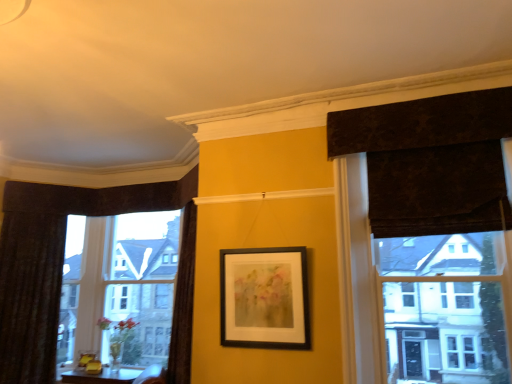
Question: Considering the relative positions of clear glass window at left and dark textured curtain at upper right, the first curtain in the front-to-back sequence, in the image provided, is clear glass window at left in front of dark textured curtain at upper right, the first curtain in the front-to-back sequence,?

Choices:
 (A) no
 (B) yes

Answer: (A)

Question: Does clear glass window at left have a smaller size compared to dark textured curtain at upper right, the second curtain in the back-to-front sequence?

Choices:
 (A) no
 (B) yes

Answer: (A)

Question: Is clear glass window at left aimed at dark textured curtain at upper right, the first curtain in the front-to-back sequence?

Choices:
 (A) yes
 (B) no

Answer: (B)

Question: From a real-world perspective, is clear glass window at left located beneath dark textured curtain at upper right, positioned as the 1th curtain in right-to-left order?

Choices:
 (A) no
 (B) yes

Answer: (B)

Question: Is dark textured curtain at upper right, the first curtain in the front-to-back sequence, completely or partially inside clear glass window at left?

Choices:
 (A) no
 (B) yes

Answer: (A)

Question: Is velvet dark brown curtain at left, which is counted as the first curtain, starting from the back, situated inside clear glass window at left or outside?

Choices:
 (A) inside
 (B) outside

Answer: (B)

Question: In the image, is velvet dark brown curtain at left, which appears as the first curtain when viewed from the left, on the left side or the right side of clear glass window at left?

Choices:
 (A) right
 (B) left

Answer: (B)

Question: From a real-world perspective, is velvet dark brown curtain at left, which is counted as the first curtain, starting from the back, physically located above or below clear glass window at left?

Choices:
 (A) below
 (B) above

Answer: (A)

Question: Considering the positions of velvet dark brown curtain at left, which is counted as the first curtain, starting from the back, and clear glass window at left in the image, is velvet dark brown curtain at left, which is counted as the first curtain, starting from the back, bigger or smaller than clear glass window at left?

Choices:
 (A) small
 (B) big

Answer: (A)

Question: From the image's perspective, is clear glass window at left above or below dark textured curtain at upper right, the first curtain in the front-to-back sequence?

Choices:
 (A) below
 (B) above

Answer: (A)

Question: From a real-world perspective, relative to dark textured curtain at upper right, positioned as the 1th curtain in right-to-left order, is clear glass window at left vertically above or below?

Choices:
 (A) above
 (B) below

Answer: (B)

Question: Considering the positions of point (146, 268) and point (445, 114), is point (146, 268) closer or farther from the camera than point (445, 114)?

Choices:
 (A) closer
 (B) farther

Answer: (B)

Question: In the image, is clear glass window at left positioned in front of or behind dark textured curtain at upper right, the first curtain in the front-to-back sequence?

Choices:
 (A) front
 (B) behind

Answer: (B)

Question: Considering the positions of point click(x=307, y=347) and point click(x=510, y=117), is point click(x=307, y=347) closer or farther from the camera than point click(x=510, y=117)?

Choices:
 (A) farther
 (B) closer

Answer: (A)

Question: From a real-world perspective, is black matte picture frame at center above or below dark textured curtain at upper right, the first curtain in the front-to-back sequence?

Choices:
 (A) below
 (B) above

Answer: (A)